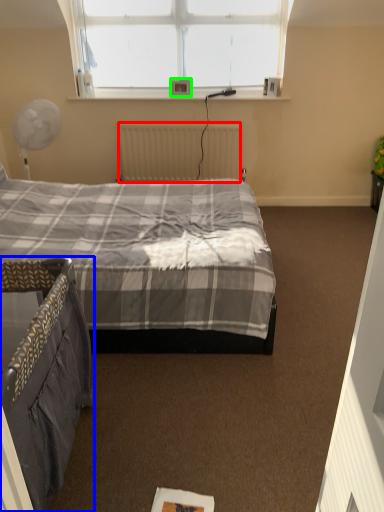
Question: Estimate the real-world distances between objects in this image. Which object is closer to radiator (highlighted by a red box), bed (highlighted by a blue box) or picture frame (highlighted by a green box)?

Choices:
 (A) bed
 (B) picture frame

Answer: (B)